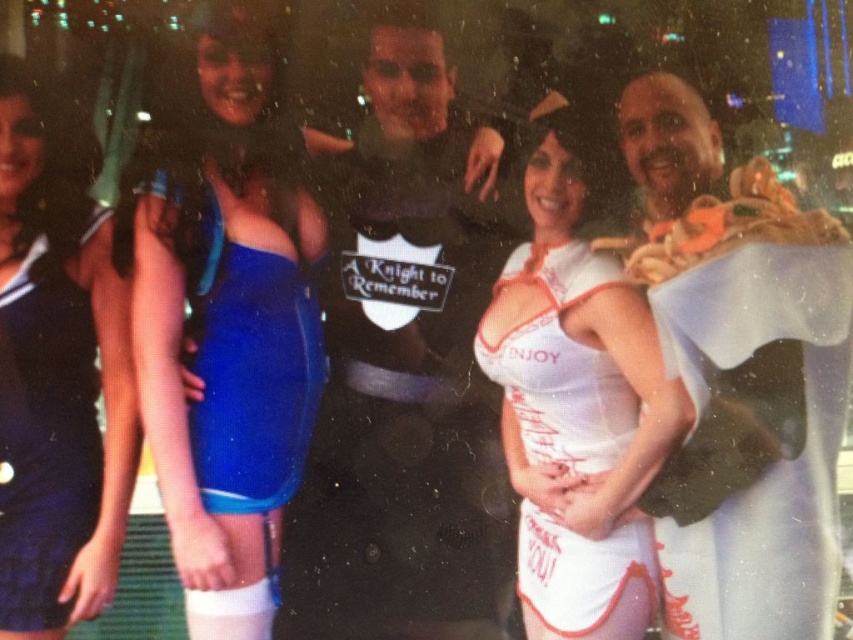
Question: Which point appears farthest from the camera in this image?

Choices:
 (A) (381, 582)
 (B) (212, 276)
 (C) (657, 596)
 (D) (759, 204)

Answer: (A)

Question: Which object is positioned farthest from the white fabric at right?

Choices:
 (A) white satin dress at center
 (B) blue fabric dress at center
 (C) matte black t-shirt at center
 (D) blue satin dress at center

Answer: (B)

Question: Observing the image, what is the correct spatial positioning of white fabric at right in reference to white satin dress at center?

Choices:
 (A) below
 (B) above

Answer: (B)

Question: Is white satin dress at center positioned at the back of blue satin dress at center?

Choices:
 (A) no
 (B) yes

Answer: (A)

Question: Which point appears closest to the camera in this image?

Choices:
 (A) (276, 452)
 (B) (306, 627)
 (C) (138, 202)
 (D) (662, 200)

Answer: (C)

Question: Does matte black t-shirt at center appear on the left side of shiny blue dress at left?

Choices:
 (A) yes
 (B) no

Answer: (B)